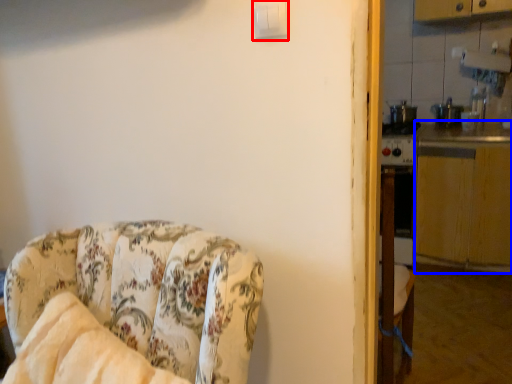
Question: Which object appears farthest to the camera in this image, light switch (highlighted by a red box) or counter top (highlighted by a blue box)?

Choices:
 (A) light switch
 (B) counter top

Answer: (B)